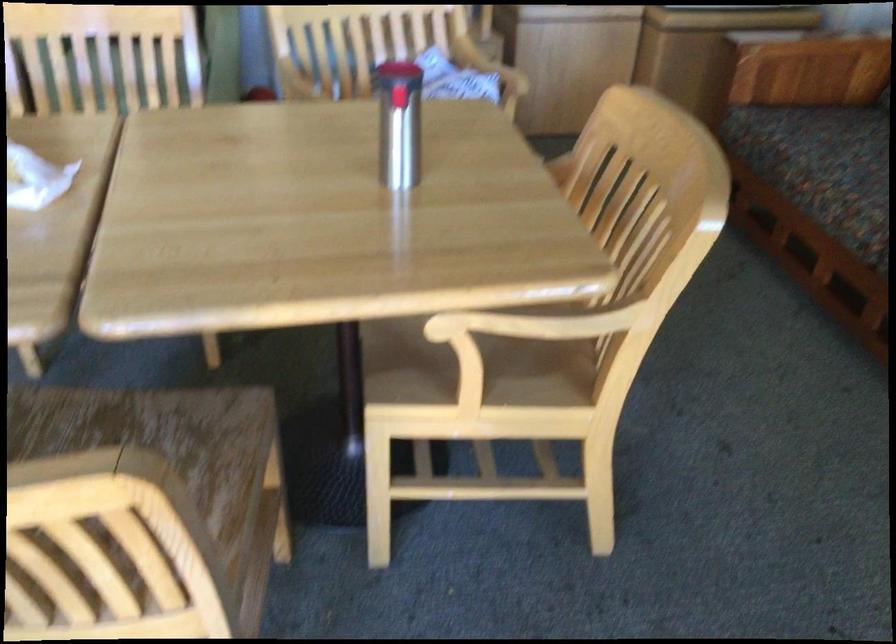
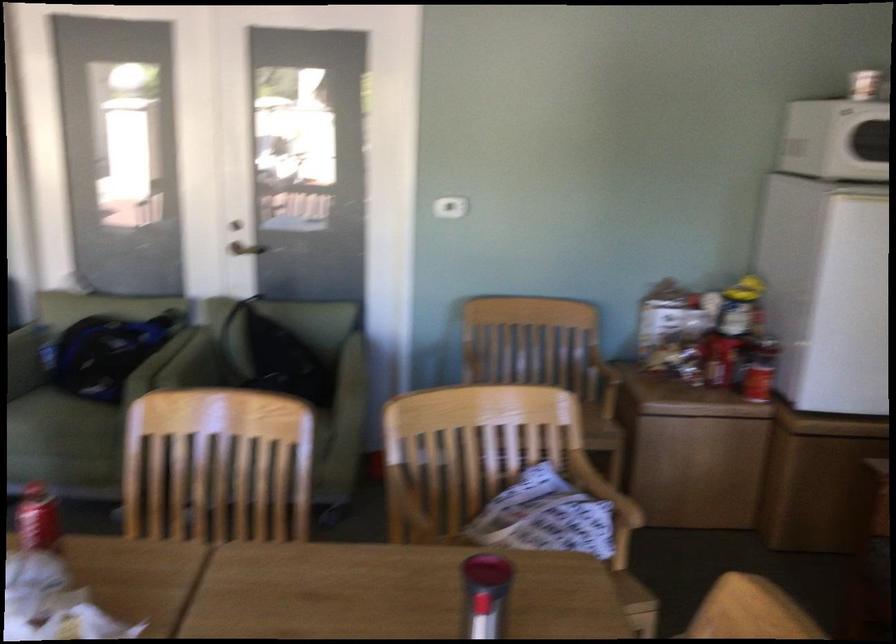
Locate, in the second image, the point that corresponds to (x=487, y=69) in the first image.

(604, 489)